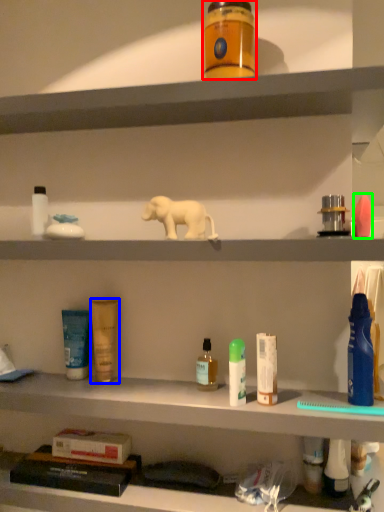
Question: Estimate the real-world distances between objects in this image. Which object is farther from toiletry (highlighted by a red box), toiletry (highlighted by a blue box) or toiletry (highlighted by a green box)?

Choices:
 (A) toiletry
 (B) toiletry

Answer: (A)